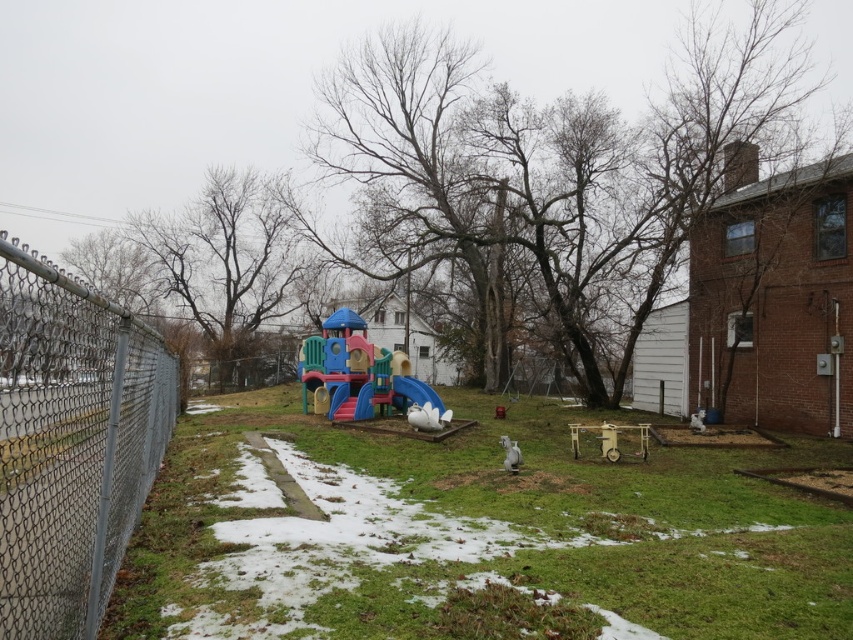
You are standing at the origin point of the backyard scene. The playground set is in front of you. Where is the green grass at center located relative to your position?

The green grass at center is located at coordinates point (474,536) relative to the origin point.

You are a parent trying to decide if your child can walk between the multicolored plastic playground at center and the white plastic slide at center without touching either. The child needs at least 1 meter of space. Can they?

The multicolored plastic playground at center might be wider than the white plastic slide at center, but the exact distance between them isn t specified. Without knowing the actual spacing, it s uncertain if there s enough room for the child to walk between them safely.